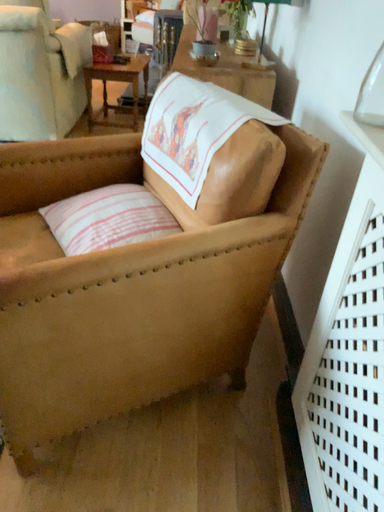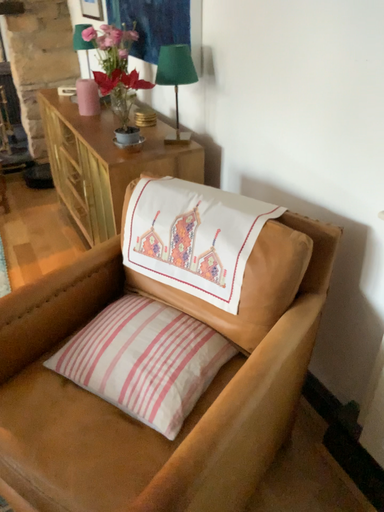
Question: Which way did the camera rotate in the video?

Choices:
 (A) rotated right
 (B) rotated left

Answer: (A)